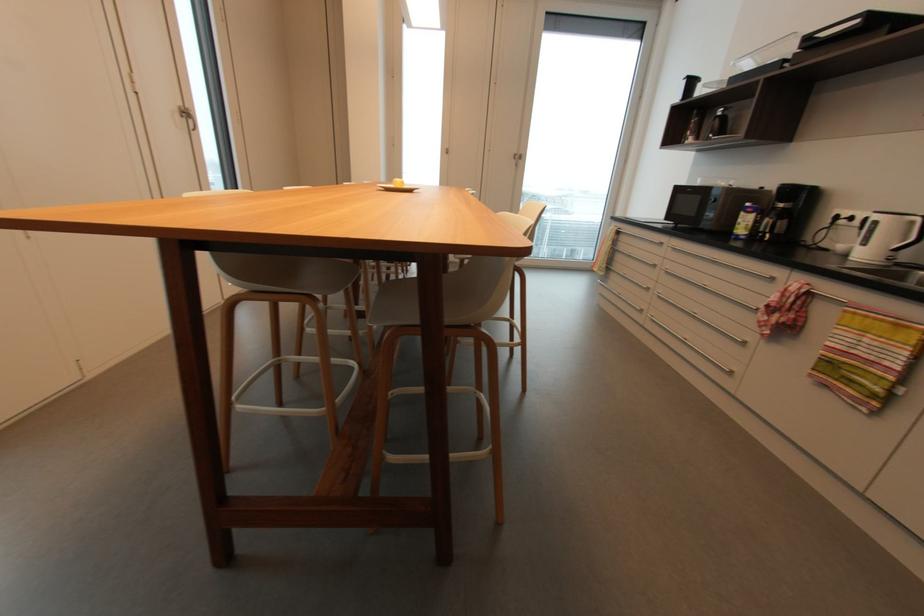
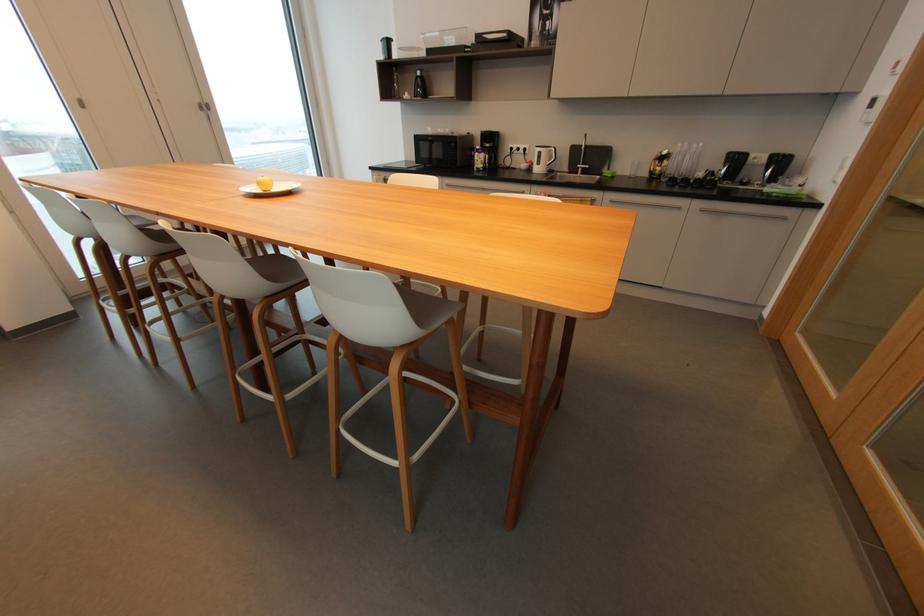
Locate, in the second image, the point that corresponds to (x=723, y=113) in the first image.

(421, 74)